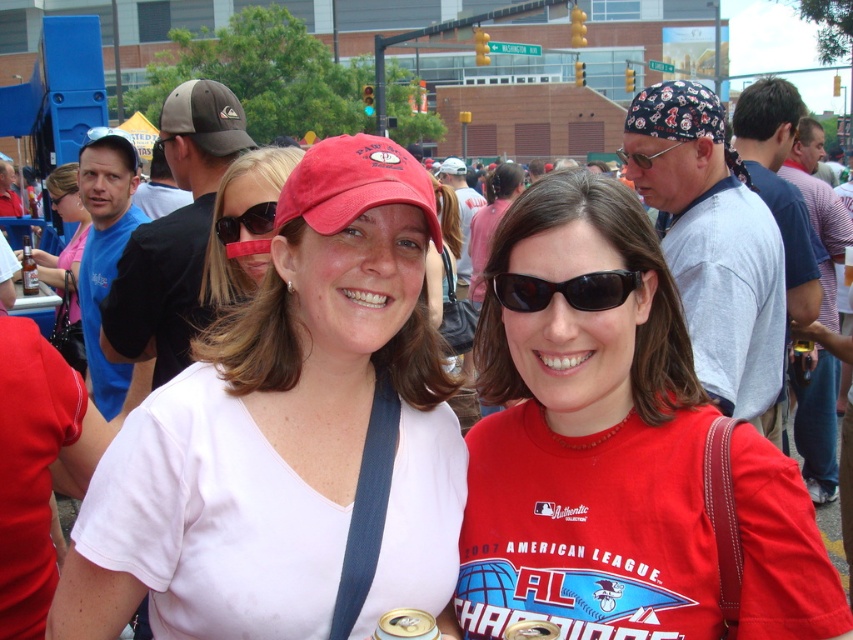
You are a photographer at the event and want to capture a clear photo of the white matte shirt at center without the black plastic sunglasses at center blocking it. Based on their positions, is this possible?

The white matte shirt at center is in front of the black plastic sunglasses at center, so taking a photo from the current angle would naturally have the white matte shirt at center blocking the view of the black plastic sunglasses at center. To capture the sunglasses clearly without obstruction, you might need to adjust your position or angle to ensure they are not behind the shirt.

You are standing in the crowd and want to move from point [534,273] to point [64,339]. Which direction should you move to get closer to the ground?

You should move towards point [64,339] because it is lower than point [534,273], so moving in that direction will bring you closer to the ground.